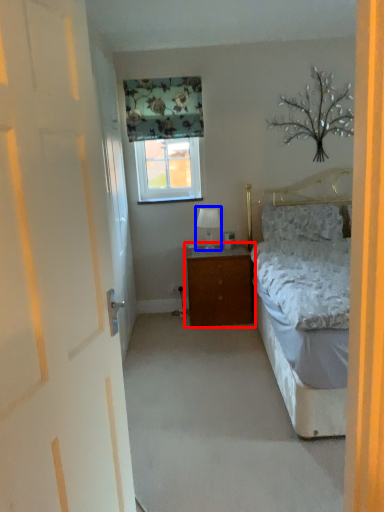
Question: Which point is further to the camera, nightstand (highlighted by a red box) or table lamp (highlighted by a blue box)?

Choices:
 (A) nightstand
 (B) table lamp

Answer: (B)